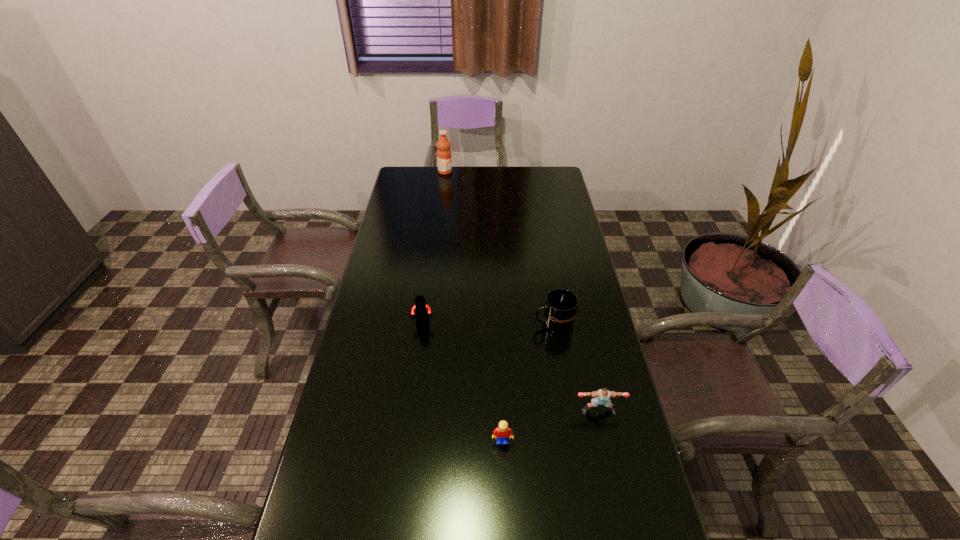
The width and height of the screenshot is (960, 540). Identify the location of object that is the second nearest to the farther Lego. (501, 433).

Identify the location of free space in the image that satisfies the following two spatial constraints: 1. on the front label of the farthest object; 2. on the front-facing side of the farther Lego. The image size is (960, 540). (427, 323).

Where is `free space that satisfies the following two spatial constraints: 1. with the handle on the side of the mug; 2. on the front-facing side of the shorter Lego`? The image size is (960, 540). free space that satisfies the following two spatial constraints: 1. with the handle on the side of the mug; 2. on the front-facing side of the shorter Lego is located at coordinates (573, 441).